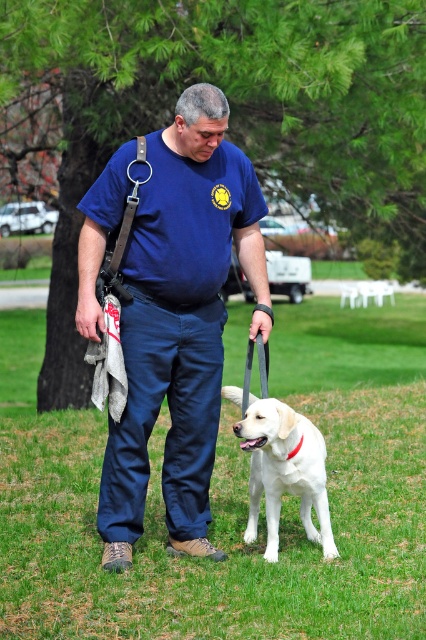
Question: Which point is farther to the camera?

Choices:
 (A) (291, 344)
 (B) (308, 492)
 (C) (169, 524)

Answer: (A)

Question: Is blue cotton shirt at center bigger than white matte dog at center?

Choices:
 (A) no
 (B) yes

Answer: (B)

Question: Considering the relative positions of green grass at center and white matte dog at center in the image provided, where is green grass at center located with respect to white matte dog at center?

Choices:
 (A) below
 (B) above

Answer: (B)

Question: Considering the real-world distances, which object is closest to the blue cotton shirt at center?

Choices:
 (A) white matte dog at center
 (B) green grass at center

Answer: (A)

Question: Which object is farther from the camera taking this photo?

Choices:
 (A) white matte dog at center
 (B) blue cotton shirt at center

Answer: (B)

Question: From the image, what is the correct spatial relationship of green grass at center in relation to white matte dog at center?

Choices:
 (A) right
 (B) left

Answer: (B)